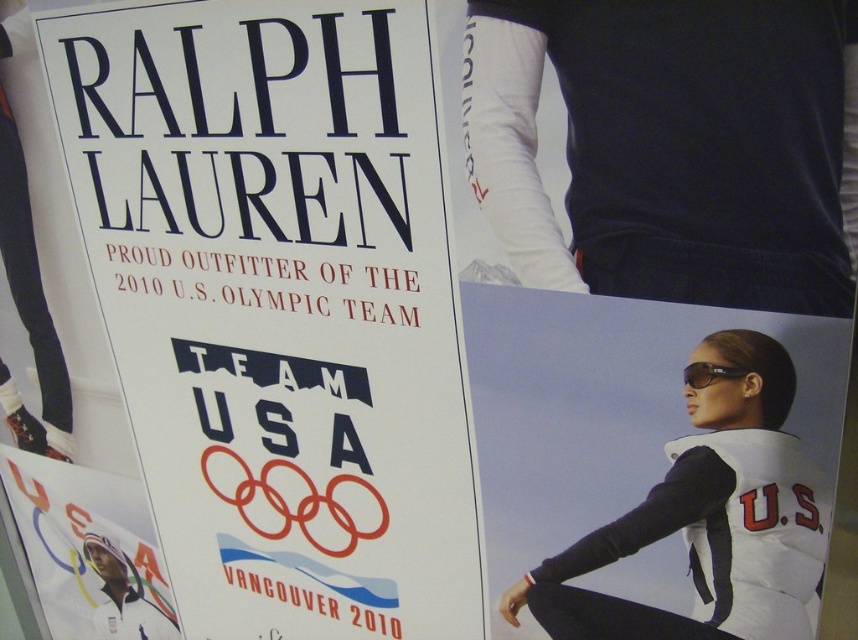
Question: Can you confirm if white paper at upper left is bigger than white matte tights at upper center?

Choices:
 (A) no
 (B) yes

Answer: (B)

Question: In this image, where is white paper at upper left located relative to white matte tights at upper center?

Choices:
 (A) left
 (B) right

Answer: (A)

Question: Among these points, which one is farthest from the camera?

Choices:
 (A) (397, 156)
 (B) (669, 192)

Answer: (A)

Question: Is white paper at upper left in front of white matte tights at upper center?

Choices:
 (A) yes
 (B) no

Answer: (B)

Question: Which point appears closest to the camera in this image?

Choices:
 (A) (808, 99)
 (B) (125, 540)
 (C) (730, 374)
 (D) (781, 349)

Answer: (A)

Question: Which of the following is the closest to the observer?

Choices:
 (A) (692, 364)
 (B) (804, 612)
 (C) (353, 352)

Answer: (A)